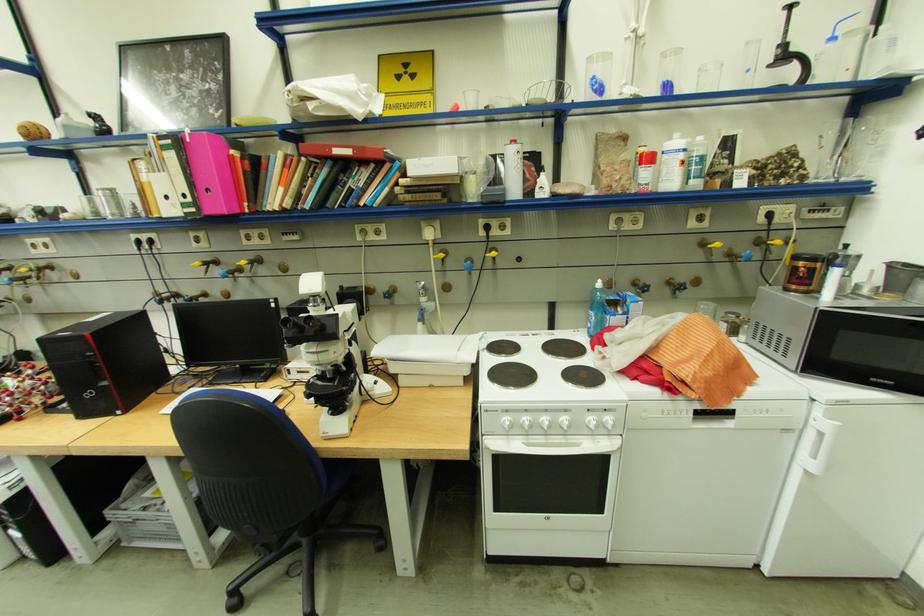
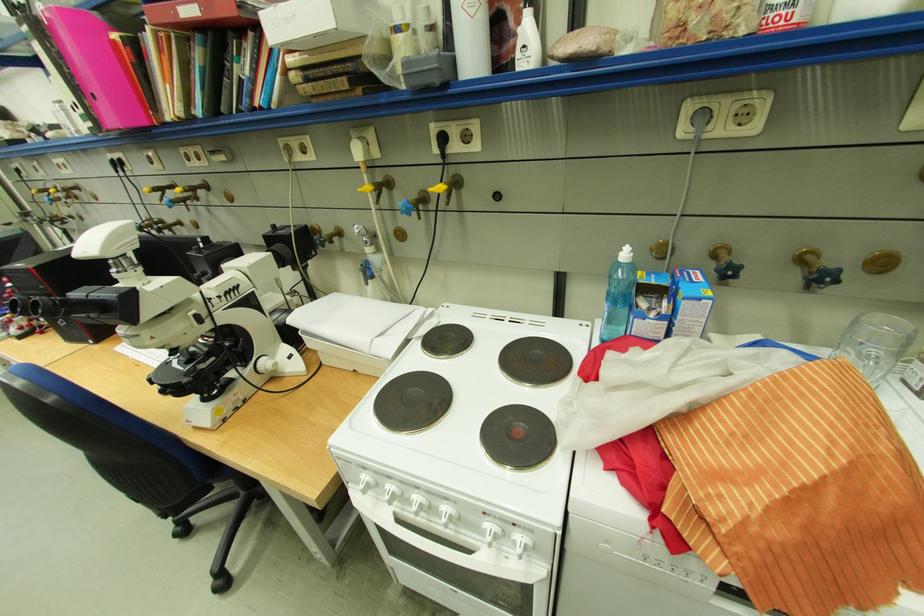
First-person continuous shooting, in which direction is the camera rotating?

The camera rotated toward left-down.